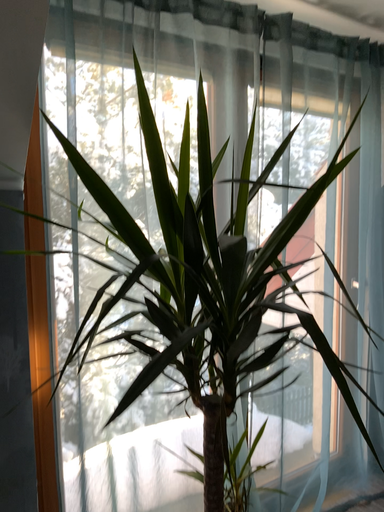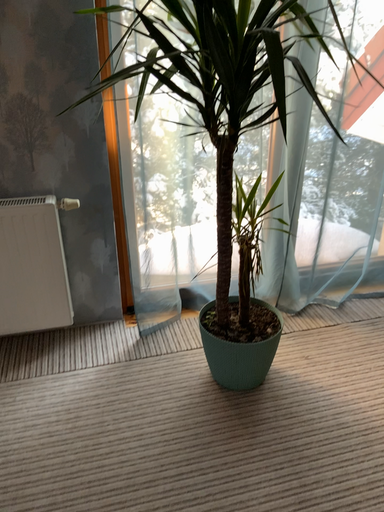
Question: How did the camera likely rotate when shooting the video?

Choices:
 (A) rotated left
 (B) rotated right

Answer: (A)